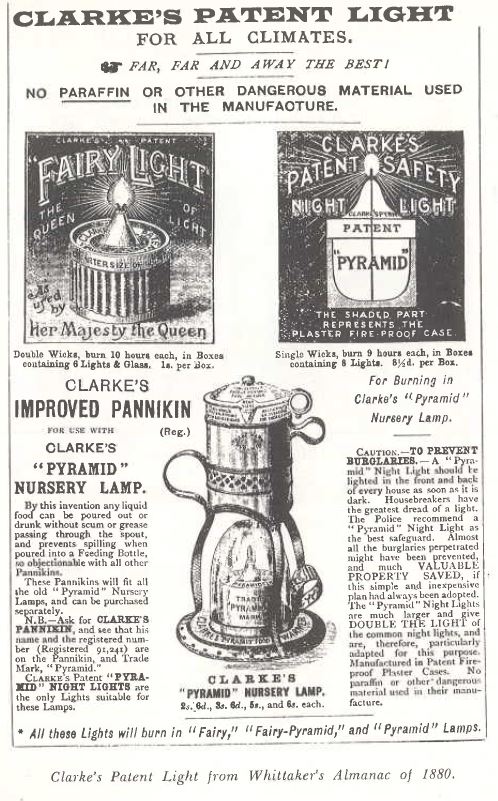
This screenshot has width=498, height=801. In order to click on there are three different models of lights here in this screenshot , I will do `click(118, 244)`, `click(371, 248)`, `click(252, 545)`.